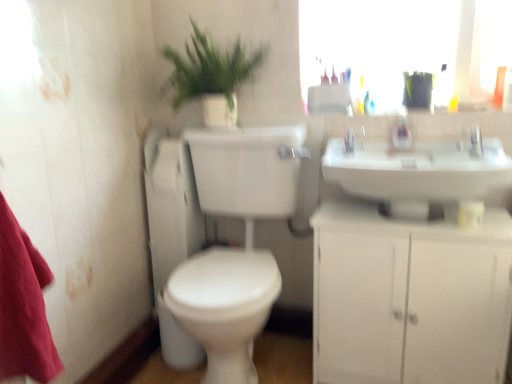
Question: Visually, is green leafy plant at upper center positioned to the left or to the right of white matte cabinet at lower right?

Choices:
 (A) left
 (B) right

Answer: (A)

Question: From the image's perspective, is green leafy plant at upper center located above or below white matte cabinet at lower right?

Choices:
 (A) below
 (B) above

Answer: (B)

Question: Which of these objects is positioned closest to the white glossy toilet at center-left?

Choices:
 (A) silver metallic faucet at upper right
 (B) white glossy sink at upper right
 (C) satin nickel faucet at upper center
 (D) white matte cabinet at lower right
 (E) green leafy plant at upper center

Answer: (E)

Question: Considering the real-world distances, which object is farthest from the white glossy toilet at center?

Choices:
 (A) satin nickel faucet at upper center
 (B) white matte cabinet at lower right
 (C) white glossy sink at upper right
 (D) silver metallic faucet at upper right
 (E) white glossy toilet at center-left

Answer: (D)